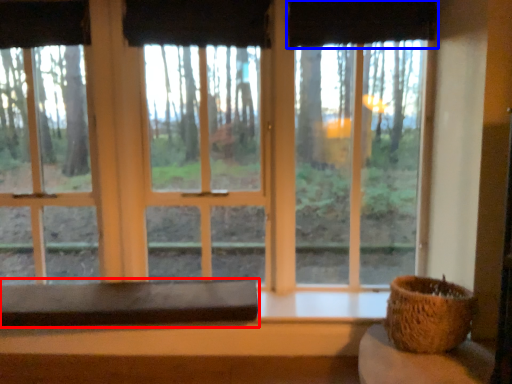
Question: Which point is further to the camera, table (highlighted by a red box) or curtain (highlighted by a blue box)?

Choices:
 (A) table
 (B) curtain

Answer: (B)